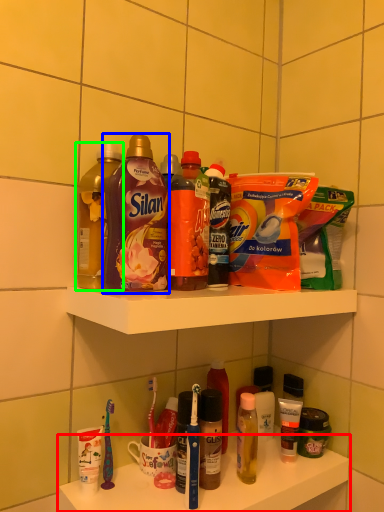
Question: Considering the real-world distances, which object is farthest from supermarket shelf (highlighted by a red box)? bottle (highlighted by a blue box) or bottle (highlighted by a green box)?

Choices:
 (A) bottle
 (B) bottle

Answer: (B)